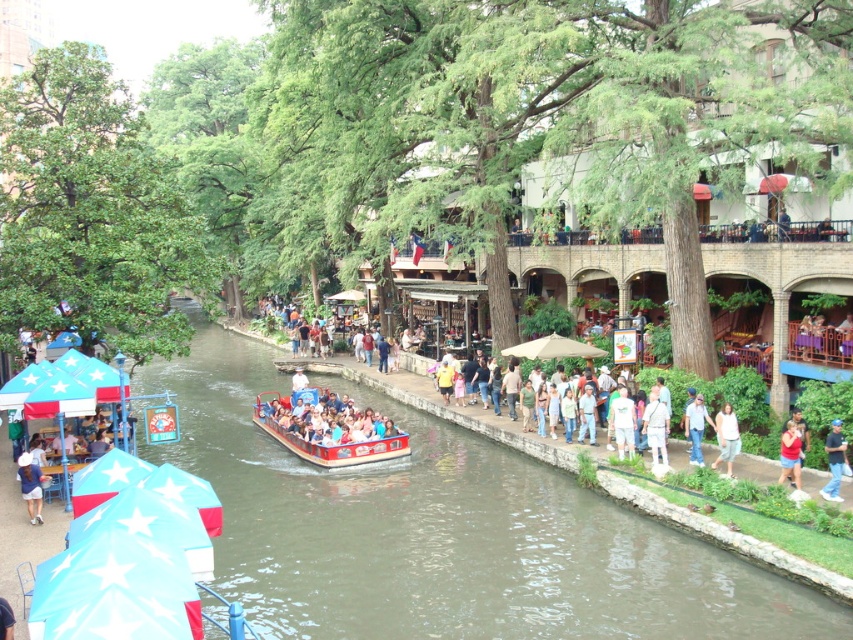
Can you confirm if brown smooth water at center is wider than denim jeans at lower right?

Correct, the width of brown smooth water at center exceeds that of denim jeans at lower right.

Is brown smooth water at center further to camera compared to denim jeans at lower right?

No, brown smooth water at center is closer to the viewer.

Does point (415, 474) come farther from viewer compared to point (689, 416)?

Yes, it is.

You are a GUI agent. You are given a task and a screenshot of the screen. Output one action in this format:
    pyautogui.click(x=<x>, y=<y>)
    Task: Click on the brown smooth water at center
    The image size is (853, 640).
    Given the screenshot: What is the action you would take?
    pyautogui.click(x=442, y=531)

Who is more distant from viewer, (28,474) or (796,484)?

Positioned behind is point (28,474).

Image resolution: width=853 pixels, height=640 pixels. What are the coordinates of `white cotton shirt at lower left` in the screenshot? It's located at (30, 484).

The width and height of the screenshot is (853, 640). What are the coordinates of `white cotton shirt at lower left` in the screenshot? It's located at (30, 484).

Is light gray cotton shirt at center behind red cotton shirt at lower right?

Yes, it is behind red cotton shirt at lower right.

Does light gray cotton shirt at center appear under red cotton shirt at lower right?

Actually, light gray cotton shirt at center is above red cotton shirt at lower right.

Where is `light gray cotton shirt at center`? The image size is (853, 640). light gray cotton shirt at center is located at coordinates (726, 436).